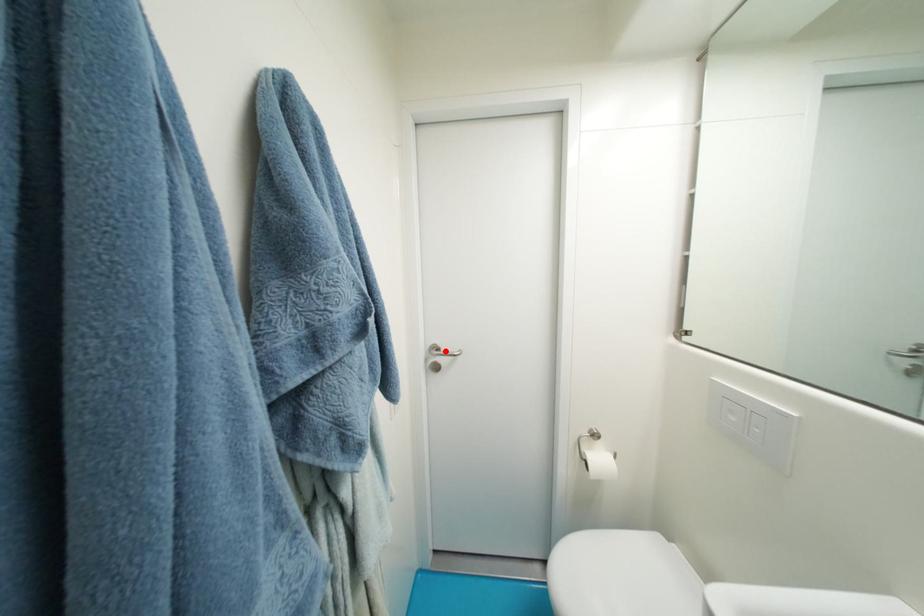
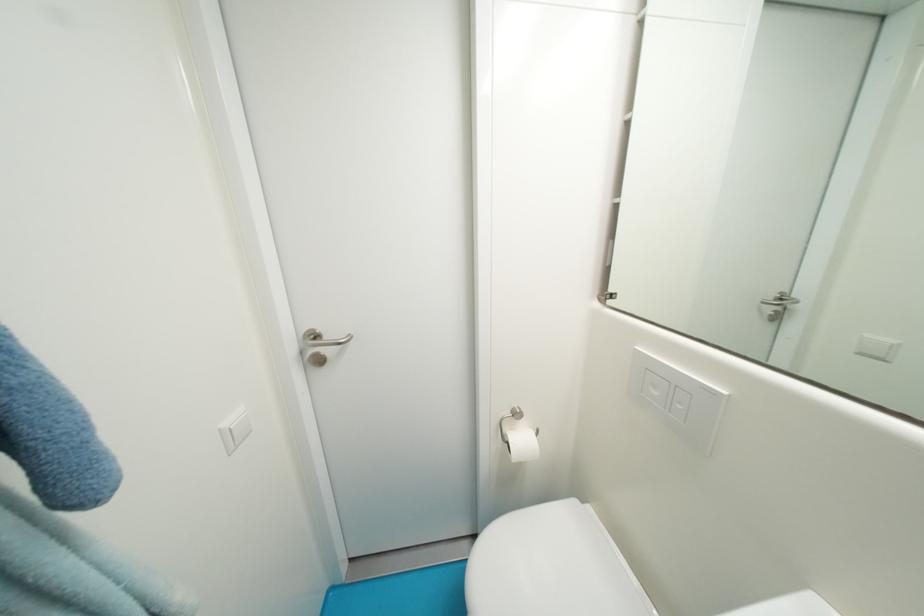
Where in the second image is the point corresponding to the highlighted location from the first image?

(323, 339)